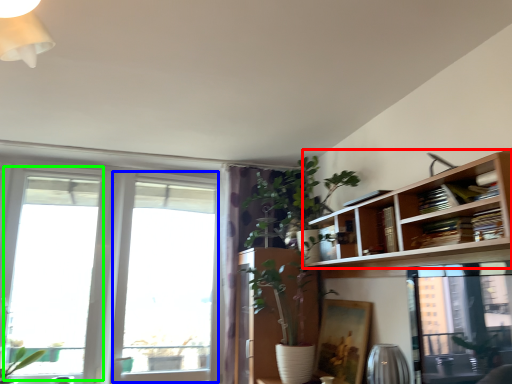
Question: Which object is the closest to the bookshelf (highlighted by a red box)? Choose among these: window (highlighted by a blue box) or window (highlighted by a green box).

Choices:
 (A) window
 (B) window

Answer: (A)